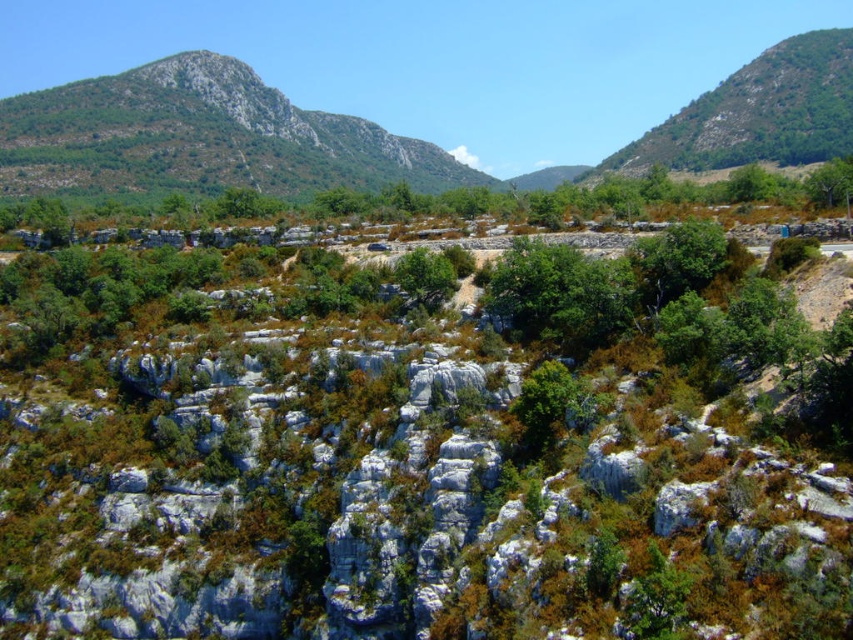
Image resolution: width=853 pixels, height=640 pixels. Describe the element at coordinates (202, 138) in the screenshot. I see `rugged stone mountain at upper left` at that location.

Which is below, rugged stone mountain at upper left or green leafy tree at center?

green leafy tree at center is below.

In the scene shown: Who is more distant from viewer, (41, 100) or (444, 260)?

Positioned behind is point (41, 100).

Locate an element on the screen. This screenshot has width=853, height=640. rugged stone mountain at upper left is located at coordinates (202, 138).

Does green leafy hillside at upper right have a lesser width compared to green leafy tree at center?

No.

Does green leafy hillside at upper right lie in front of green leafy tree at center?

No, green leafy hillside at upper right is behind green leafy tree at center.

Between point (840, 148) and point (405, 259), which one is positioned behind?

Positioned behind is point (840, 148).

In order to click on green leafy hillside at upper right in this screenshot , I will do `click(756, 113)`.

Does rugged stone mountain at upper left have a lesser width compared to green leafy hillside at upper right?

In fact, rugged stone mountain at upper left might be wider than green leafy hillside at upper right.

Can you confirm if rugged stone mountain at upper left is wider than green leafy hillside at upper right?

Yes, rugged stone mountain at upper left is wider than green leafy hillside at upper right.

The width and height of the screenshot is (853, 640). I want to click on rugged stone mountain at upper left, so click(202, 138).